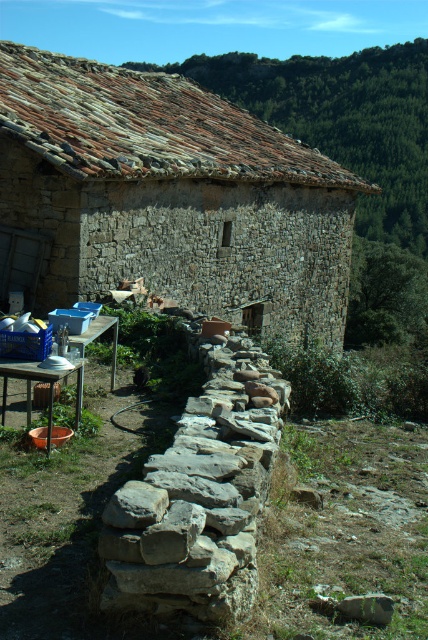
Is rustic stone hut at upper left taller than gray rough stone at lower center?

Yes.

Is point (171, 173) positioned after point (357, 616)?

Yes, it is behind point (357, 616).

Between point (80, 273) and point (362, 611), which one is positioned behind?

Point (80, 273)

You are a GUI agent. You are given a task and a screenshot of the screen. Output one action in this format:
    pyautogui.click(x=<x>, y=<y>)
    Task: Click on the rustic stone hut at upper left
    
    Given the screenshot: What is the action you would take?
    pyautogui.click(x=169, y=195)

Based on the photo, can you confirm if natural stone wall at center is shorter than gray rough stone at lower center?

Incorrect, natural stone wall at center's height does not fall short of gray rough stone at lower center's.

Is point (234, 376) behind point (368, 596)?

Yes, point (234, 376) is farther from viewer.

Identify the location of natural stone wall at center. This screenshot has height=640, width=428. (199, 497).

Can you confirm if rustic stone roof at upper center is positioned to the left of gray rough stone at lower center?

Incorrect, rustic stone roof at upper center is not on the left side of gray rough stone at lower center.

Is rustic stone roof at upper center taller than gray rough stone at lower center?

Correct, rustic stone roof at upper center is much taller as gray rough stone at lower center.

Does point (383, 100) come behind point (392, 602)?

Yes.

You are a GUI agent. You are given a task and a screenshot of the screen. Output one action in this format:
    pyautogui.click(x=<x>, y=<y>)
    Task: Click on the rustic stone roof at upper center
    
    Given the screenshot: What is the action you would take?
    pyautogui.click(x=342, y=120)